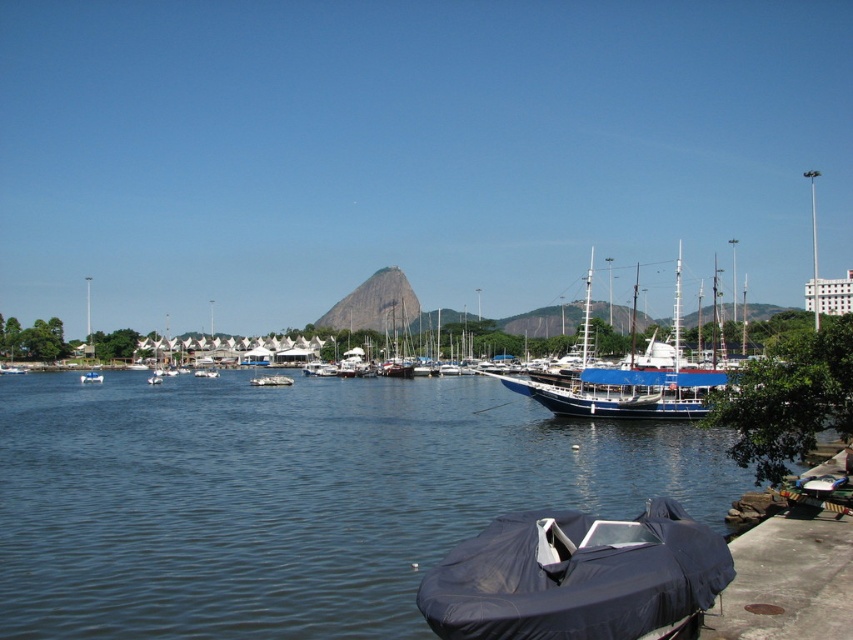
Is white matte boat at center shorter than white plastic boat at center?

No, white matte boat at center is not shorter than white plastic boat at center.

Between white matte boat at center and white plastic boat at center, which one has less height?

white plastic boat at center

Is point (260, 376) farther from viewer compared to point (94, 380)?

Yes, point (260, 376) is farther from viewer.

Where is `white matte boat at center`? The width and height of the screenshot is (853, 640). white matte boat at center is located at coordinates [271, 380].

Between blue water at lower left and blue polished wood sailboat at center, which one is positioned higher?

blue polished wood sailboat at center is above.

Does blue water at lower left have a smaller size compared to blue polished wood sailboat at center?

Correct, blue water at lower left occupies less space than blue polished wood sailboat at center.

In order to click on blue water at lower left in this screenshot , I will do `click(293, 497)`.

Does point (253, 504) lie in front of point (634, 545)?

No.

Does blue water at lower left appear on the right side of dark blue tarpaulin boat at lower center?

No, blue water at lower left is not to the right of dark blue tarpaulin boat at lower center.

Locate an element on the screen. The height and width of the screenshot is (640, 853). blue water at lower left is located at coordinates (293, 497).

The width and height of the screenshot is (853, 640). Identify the location of blue water at lower left. (293, 497).